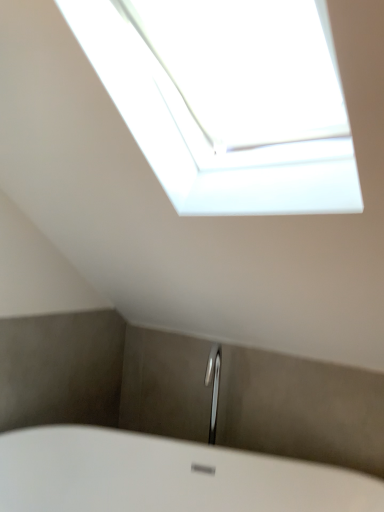
Question: Is transparent glass window at upper center positioned beyond the bounds of white glossy bathtub at lower center?

Choices:
 (A) yes
 (B) no

Answer: (A)

Question: Does transparent glass window at upper center come behind white glossy bathtub at lower center?

Choices:
 (A) no
 (B) yes

Answer: (A)

Question: Is transparent glass window at upper center aimed at white glossy bathtub at lower center?

Choices:
 (A) no
 (B) yes

Answer: (A)

Question: Considering the relative sizes of transparent glass window at upper center and white glossy bathtub at lower center in the image provided, is transparent glass window at upper center bigger than white glossy bathtub at lower center?

Choices:
 (A) no
 (B) yes

Answer: (A)

Question: Is white glossy bathtub at lower center inside transparent glass window at upper center?

Choices:
 (A) no
 (B) yes

Answer: (A)

Question: Is transparent glass window at upper center thinner than white glossy bathtub at lower center?

Choices:
 (A) no
 (B) yes

Answer: (A)

Question: From the image's perspective, does white glossy bathtub at lower center appear lower than transparent glass window at upper center?

Choices:
 (A) no
 (B) yes

Answer: (B)

Question: Is white glossy bathtub at lower center far away from transparent glass window at upper center?

Choices:
 (A) no
 (B) yes

Answer: (B)

Question: Is transparent glass window at upper center a part of white glossy bathtub at lower center?

Choices:
 (A) yes
 (B) no

Answer: (B)

Question: Can you confirm if white glossy bathtub at lower center is shorter than transparent glass window at upper center?

Choices:
 (A) no
 (B) yes

Answer: (B)

Question: Is the surface of white glossy bathtub at lower center in direct contact with transparent glass window at upper center?

Choices:
 (A) no
 (B) yes

Answer: (A)

Question: From a real-world perspective, is white glossy bathtub at lower center under transparent glass window at upper center?

Choices:
 (A) no
 (B) yes

Answer: (B)

Question: Based on their sizes in the image, would you say white glossy bathtub at lower center is bigger or smaller than transparent glass window at upper center?

Choices:
 (A) small
 (B) big

Answer: (B)